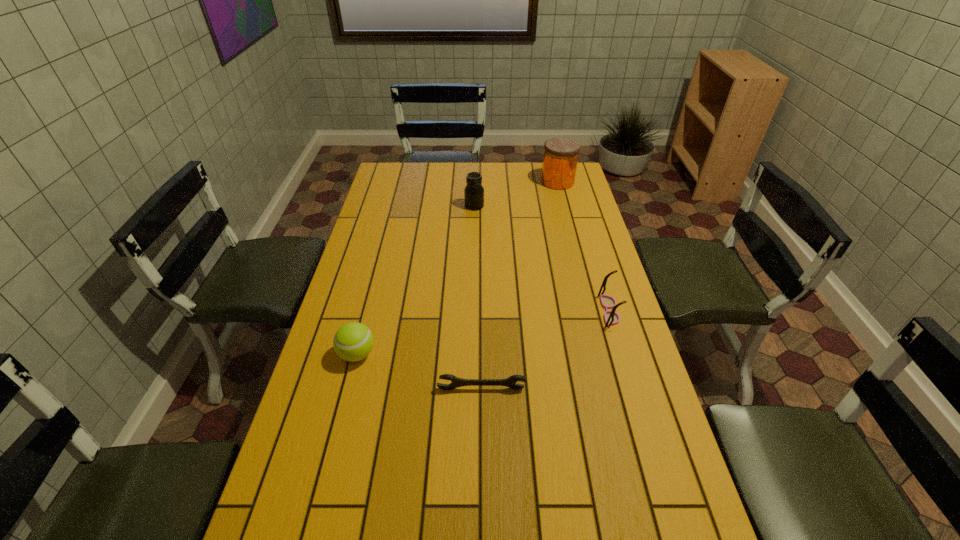
The height and width of the screenshot is (540, 960). I want to click on vacant space at the left edge, so click(399, 232).

Find the location of a particular element. The width and height of the screenshot is (960, 540). vacant space at the right edge of the desktop is located at coordinates (571, 244).

Locate an element on the screen. This screenshot has height=540, width=960. free region at the far left corner is located at coordinates (385, 165).

The height and width of the screenshot is (540, 960). Identify the location of vacant point located between the fourth nearest object and the shortest object. (478, 297).

The height and width of the screenshot is (540, 960). What are the coordinates of `unoccupied area between the nearer jar and the nearest object` in the screenshot? It's located at (478, 297).

At what (x,y) coordinates should I click in order to perform the action: click on free space between the nearer jar and the shortest object. Please return your answer as a coordinate pair (x, y). Looking at the image, I should click on (478, 297).

Find the location of a particular element. unoccupied position between the tallest object and the leftmost object is located at coordinates (457, 268).

This screenshot has width=960, height=540. Identify the location of vacant area that lies between the tallest object and the shortest object. (519, 285).

This screenshot has width=960, height=540. What are the coordinates of `vacant point located between the shorter jar and the right jar` in the screenshot? It's located at (516, 194).

Find the location of `free space between the second nearest object and the farther jar`. free space between the second nearest object and the farther jar is located at coordinates (457, 268).